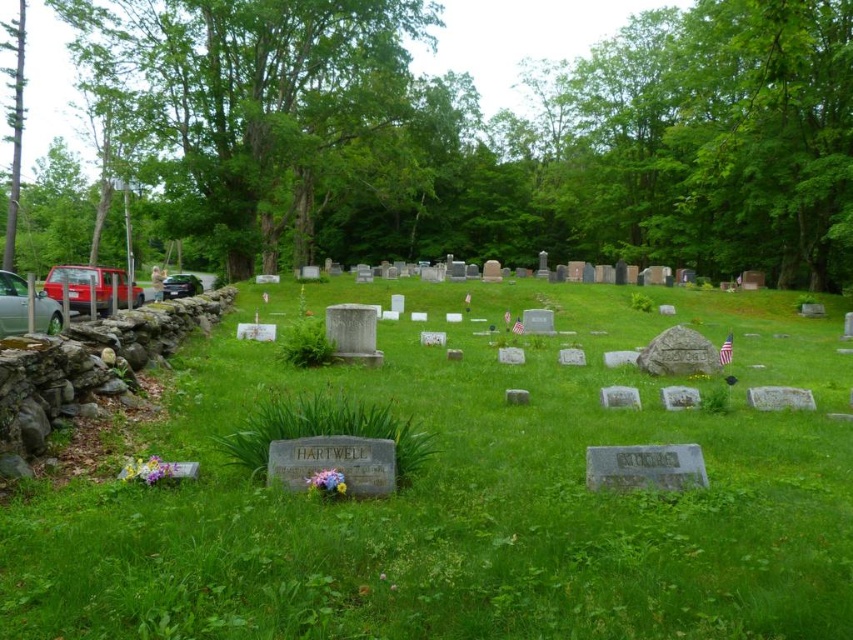
You are standing at the entrance of the cemetery and want to visit two graves located at point (694, 401) and point (190, 285). Which grave should you visit first to minimize the distance walked?

You should visit the grave at point (694, 401) first because it is closer to the entrance than point (190, 285).

You are a visitor at the cemetery and need to park your car. You see two cars already parked at the left side of the cemetery. Which car has a wider body between the matte red car at left and the shiny black car at left?

The matte red car at left has a wider body than the shiny black car at left.

In the scene shown: You are planning to place a new bench in the cemetery. The bench requires a space wider than the white marble gravestone at center. Can the area near the green leafy tree at left accommodate this bench?

The green leafy tree at left is wider than the white marble gravestone at center, so the area near the green leafy tree at left can accommodate the bench since its width is sufficient.